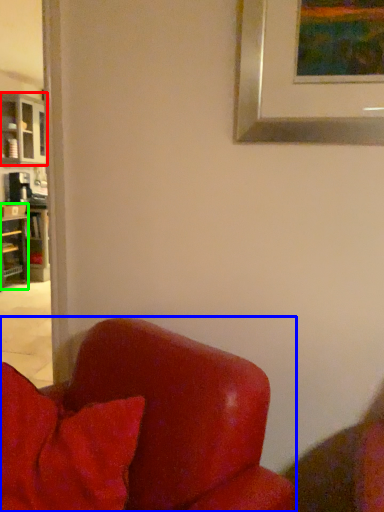
Question: Considering the real-world distances, which object is farthest from cabinetry (highlighted by a red box)? chair (highlighted by a blue box) or shelf (highlighted by a green box)?

Choices:
 (A) chair
 (B) shelf

Answer: (A)